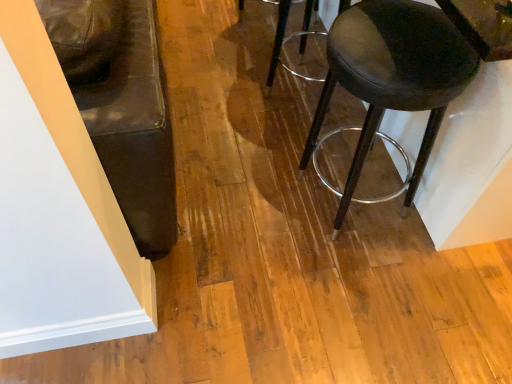
Find the location of a particular element. vacant space that is to the left of transparent plastic stool at center, which is the 1th stool in top-to-bottom order is located at coordinates (231, 99).